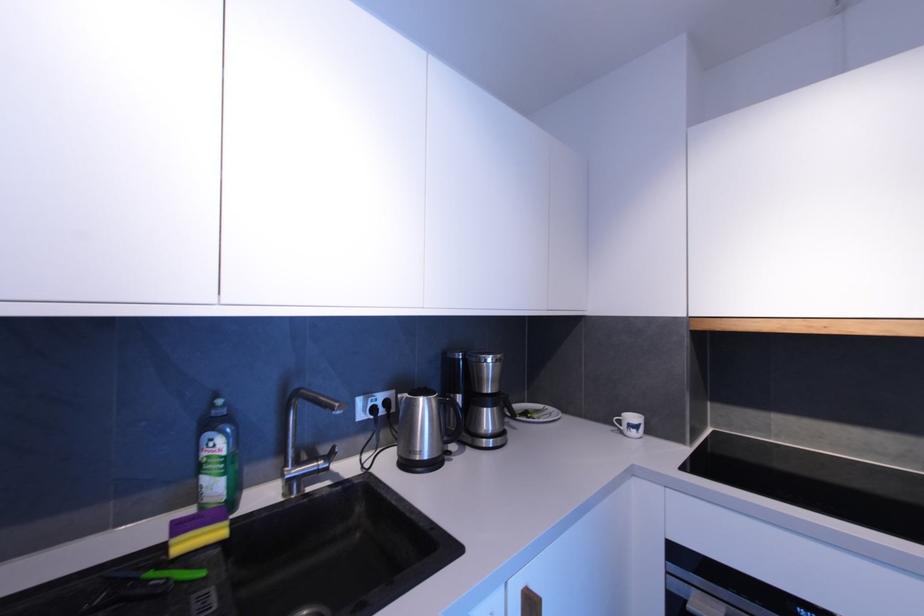
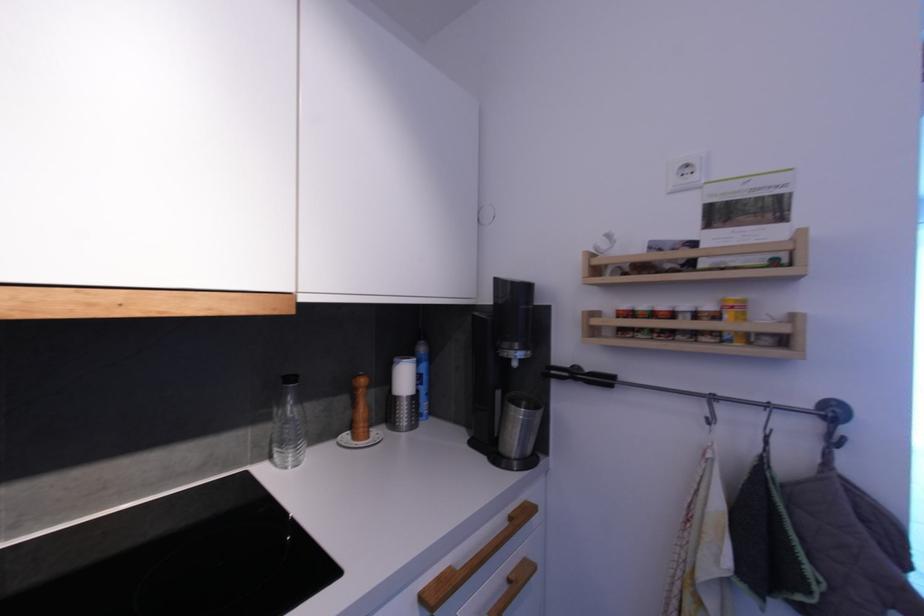
Question: The images are taken continuously from a first-person perspective. In which direction is your viewpoint rotating?

Choices:
 (A) Left
 (B) Right
 (C) Up
 (D) Down

Answer: (B)